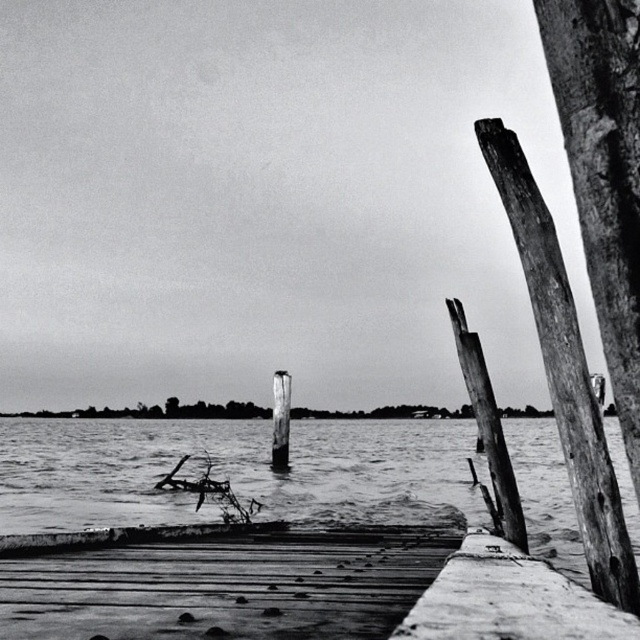
Question: Does smooth water at center lie in front of smooth wood post at center?

Choices:
 (A) yes
 (B) no

Answer: (A)

Question: Can you confirm if smooth water at center is bigger than weathered wood post at right?

Choices:
 (A) no
 (B) yes

Answer: (B)

Question: Which point is farther from the camera taking this photo?

Choices:
 (A) (61, 602)
 (B) (285, 438)

Answer: (B)

Question: Which point is closer to the camera taking this photo?

Choices:
 (A) (275, 387)
 (B) (273, 596)
 (C) (458, 348)
 (D) (520, 241)

Answer: (D)

Question: Which object is the farthest from the smooth water at center?

Choices:
 (A) weathered wood post at right
 (B) smooth wood post at center
 (C) wooden post at right

Answer: (C)

Question: Can you confirm if weathered wood post at right is positioned to the right of smooth wood post at center?

Choices:
 (A) yes
 (B) no

Answer: (A)